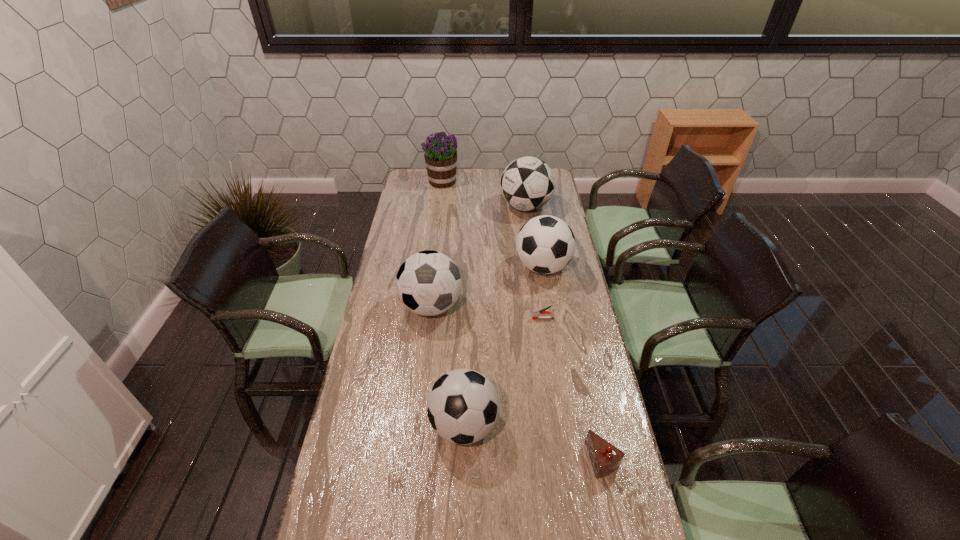
At what (x,y) coordinates should I click in order to perform the action: click on object that is at the far left corner. Please return your answer as a coordinate pair (x, y). Looking at the image, I should click on (440, 155).

This screenshot has height=540, width=960. Find the location of `free space at the far edge of the desktop`. free space at the far edge of the desktop is located at coordinates (461, 172).

What are the coordinates of `free space at the left edge` in the screenshot? It's located at (398, 217).

This screenshot has width=960, height=540. What are the coordinates of `vacant space at the right edge of the desktop` in the screenshot? It's located at (603, 370).

Identify the location of vacant space at the far left corner of the desktop. The height and width of the screenshot is (540, 960). (426, 186).

This screenshot has width=960, height=540. Identify the location of free space that is in between the bouquet and the sixth nearest object. (484, 194).

Identify which object is the second closest to the sixth nearest object. Please provide its 2D coordinates. Your answer should be formatted as a tuple, i.e. [(x, y)], where the tuple contains the x and y coordinates of a point satisfying the conditions above.

[(440, 155)]

Identify which object is the sixth nearest to the farthest object. Please provide its 2D coordinates. Your answer should be formatted as a tuple, i.e. [(x, y)], where the tuple contains the x and y coordinates of a point satisfying the conditions above.

[(605, 458)]

Where is `soccer ball that is the closest one to the bouquet`? The image size is (960, 540). soccer ball that is the closest one to the bouquet is located at coordinates (527, 183).

Identify the location of the closest soccer ball to the farthest soccer ball. (545, 244).